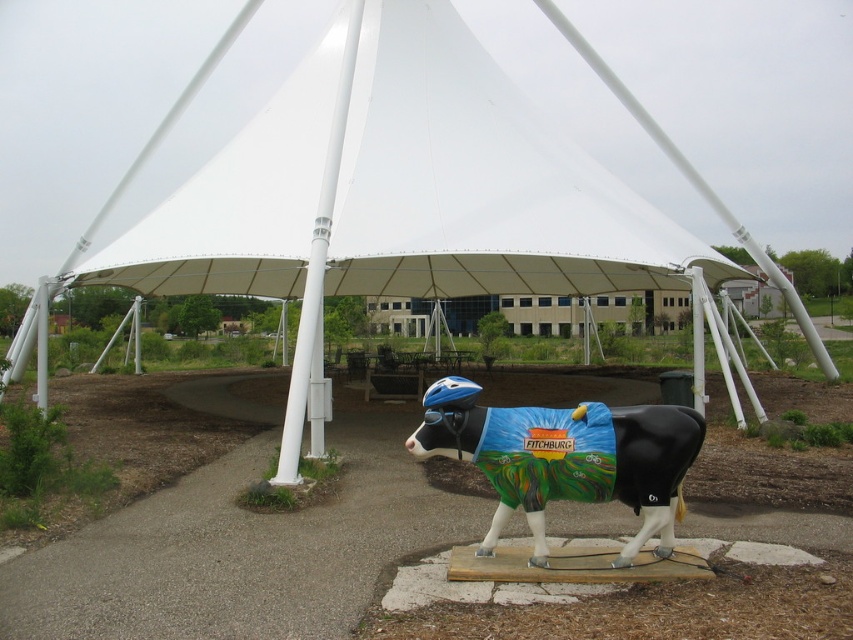
Question: Is white fabric tent at center in front of painted fiberglass cow at center?

Choices:
 (A) yes
 (B) no

Answer: (B)

Question: Does white fabric tent at center lie in front of painted fiberglass cow at center?

Choices:
 (A) no
 (B) yes

Answer: (A)

Question: Among these points, which one is nearest to the camera?

Choices:
 (A) (256, 291)
 (B) (677, 492)

Answer: (B)

Question: Does white fabric tent at center appear over painted fiberglass cow at center?

Choices:
 (A) yes
 (B) no

Answer: (A)

Question: Which point is farther to the camera?

Choices:
 (A) white fabric tent at center
 (B) painted fiberglass cow at center

Answer: (A)